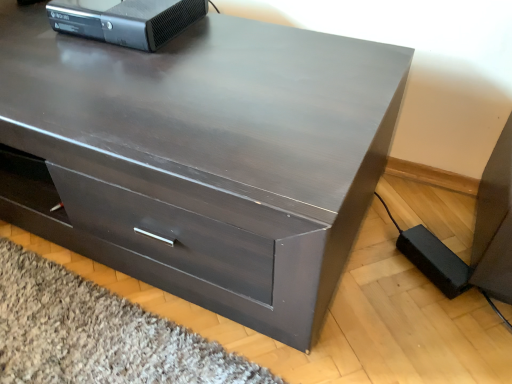
Question: Is black plastic xbox 360 at upper left inside or outside of matte dark wood chest of drawers at center?

Choices:
 (A) outside
 (B) inside

Answer: (A)

Question: Considering the positions of black plastic xbox 360 at upper left and matte dark wood chest of drawers at center in the image, is black plastic xbox 360 at upper left wider or thinner than matte dark wood chest of drawers at center?

Choices:
 (A) thin
 (B) wide

Answer: (A)

Question: From the image's perspective, is black plastic xbox 360 at upper left positioned above or below matte dark wood chest of drawers at center?

Choices:
 (A) above
 (B) below

Answer: (A)

Question: Would you say matte dark wood chest of drawers at center is to the left or to the right of black plastic xbox 360 at upper left in the picture?

Choices:
 (A) left
 (B) right

Answer: (A)

Question: Is matte dark wood chest of drawers at center taller or shorter than black plastic xbox 360 at upper left?

Choices:
 (A) tall
 (B) short

Answer: (A)

Question: Considering their positions, is matte dark wood chest of drawers at center located in front of or behind black plastic xbox 360 at upper left?

Choices:
 (A) behind
 (B) front

Answer: (B)

Question: Is point (163, 130) closer or farther from the camera than point (101, 36)?

Choices:
 (A) closer
 (B) farther

Answer: (A)